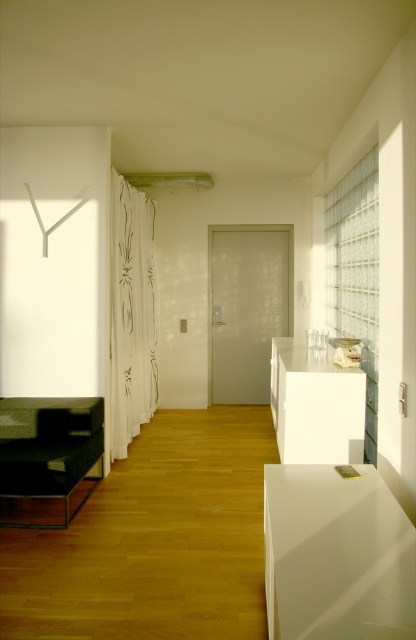
Question: Considering the real-world distances, which object is farthest from the white glossy cabinet at center?

Choices:
 (A) clear glass curtain at right
 (B) white sheer curtain at left
 (C) matte black coffee table at left
 (D) white glossy cabinet at lower right

Answer: (C)

Question: Is white sheer curtain at left above matte black coffee table at left?

Choices:
 (A) no
 (B) yes

Answer: (B)

Question: Considering the real-world distances, which object is farthest from the matte black coffee table at left?

Choices:
 (A) white glossy cabinet at lower right
 (B) clear glass curtain at right
 (C) white glossy cabinet at center

Answer: (B)

Question: Which object is closer to the camera taking this photo?

Choices:
 (A) clear glass curtain at right
 (B) matte black coffee table at left
 (C) white glossy cabinet at center
 (D) white sheer curtain at left

Answer: (B)

Question: Does white sheer curtain at left lie behind clear glass curtain at right?

Choices:
 (A) yes
 (B) no

Answer: (A)

Question: Is white glossy cabinet at lower right thinner than white glossy cabinet at center?

Choices:
 (A) yes
 (B) no

Answer: (B)